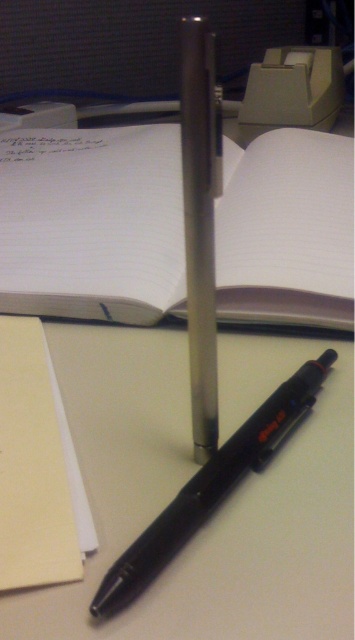
Which is below, white paper notebook at center or black matte pen at center?

black matte pen at center is below.

Identify the location of white paper notebook at center. The width and height of the screenshot is (355, 640). (91, 224).

Image resolution: width=355 pixels, height=640 pixels. What do you see at coordinates (91, 224) in the screenshot? I see `white paper notebook at center` at bounding box center [91, 224].

Find the location of a particular element. white paper notebook at center is located at coordinates (91, 224).

Is point (248, 157) in front of point (9, 349)?

No, it is behind (9, 349).

Where is `white paper notebook at center`? white paper notebook at center is located at coordinates (91, 224).

In the scene shown: Who is more distant from viewer, (x=346, y=262) or (x=35, y=328)?

The point (x=346, y=262) is behind.

Locate an element on the screen. This screenshot has height=640, width=355. white paper notebook at center is located at coordinates (91, 224).

Can you confirm if yellow paper at lower left is taller than black matte pen at center?

Yes.

Who is positioned more to the right, yellow paper at lower left or black matte pen at center?

black matte pen at center is more to the right.

Does point (22, 440) come in front of point (325, 358)?

Yes, point (22, 440) is closer to viewer.

Locate an element on the screen. The image size is (355, 640). yellow paper at lower left is located at coordinates (36, 467).